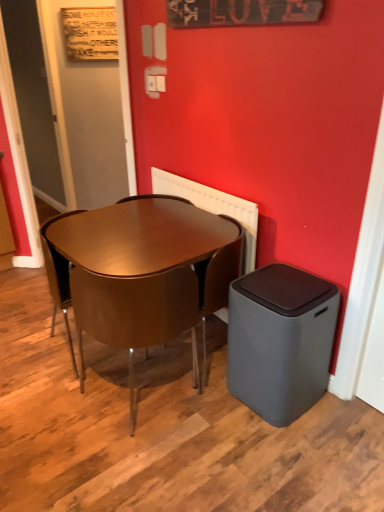
At what (x,y) coordinates should I click in order to perform the action: click on vacant space to the left of matte brown table at center. Please return your answer as a coordinate pair (x, y). This screenshot has width=384, height=512. Looking at the image, I should click on (33, 354).